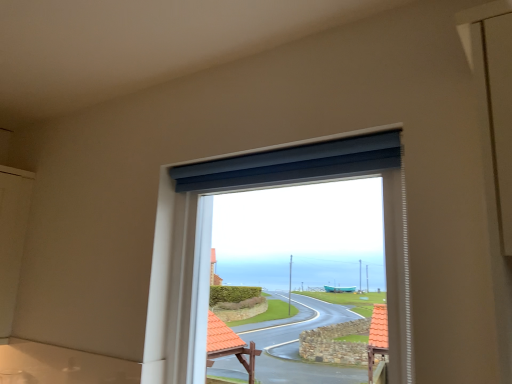
Question: Is matte blue roller blind at center not inside matte blue curtain at upper center?

Choices:
 (A) no
 (B) yes

Answer: (B)

Question: Does matte blue roller blind at center lie behind matte blue curtain at upper center?

Choices:
 (A) no
 (B) yes

Answer: (A)

Question: From the image's perspective, would you say matte blue roller blind at center is shown under matte blue curtain at upper center?

Choices:
 (A) no
 (B) yes

Answer: (B)

Question: Considering the relative sizes of matte blue roller blind at center and matte blue curtain at upper center in the image provided, is matte blue roller blind at center shorter than matte blue curtain at upper center?

Choices:
 (A) no
 (B) yes

Answer: (A)

Question: Does matte blue roller blind at center have a larger size compared to matte blue curtain at upper center?

Choices:
 (A) yes
 (B) no

Answer: (A)

Question: Is matte blue roller blind at center smaller than matte blue curtain at upper center?

Choices:
 (A) no
 (B) yes

Answer: (A)

Question: Does matte blue curtain at upper center have a lesser width compared to matte blue roller blind at center?

Choices:
 (A) yes
 (B) no

Answer: (A)

Question: Is matte blue roller blind at center located within matte blue curtain at upper center?

Choices:
 (A) no
 (B) yes

Answer: (A)

Question: Can you confirm if matte blue curtain at upper center is shorter than matte blue roller blind at center?

Choices:
 (A) yes
 (B) no

Answer: (A)

Question: Is matte blue curtain at upper center at the right side of matte blue roller blind at center?

Choices:
 (A) yes
 (B) no

Answer: (B)

Question: Is matte blue curtain at upper center wider than matte blue roller blind at center?

Choices:
 (A) no
 (B) yes

Answer: (A)

Question: Can you confirm if matte blue curtain at upper center is smaller than matte blue roller blind at center?

Choices:
 (A) no
 (B) yes

Answer: (B)

Question: From a real-world perspective, is matte blue roller blind at center positioned above or below matte blue curtain at upper center?

Choices:
 (A) below
 (B) above

Answer: (A)